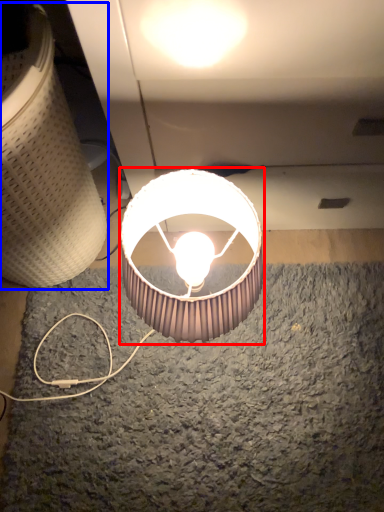
Question: Which of the following is the closest to the observer, lamp (highlighted by a red box) or lamp (highlighted by a blue box)?

Choices:
 (A) lamp
 (B) lamp

Answer: (B)